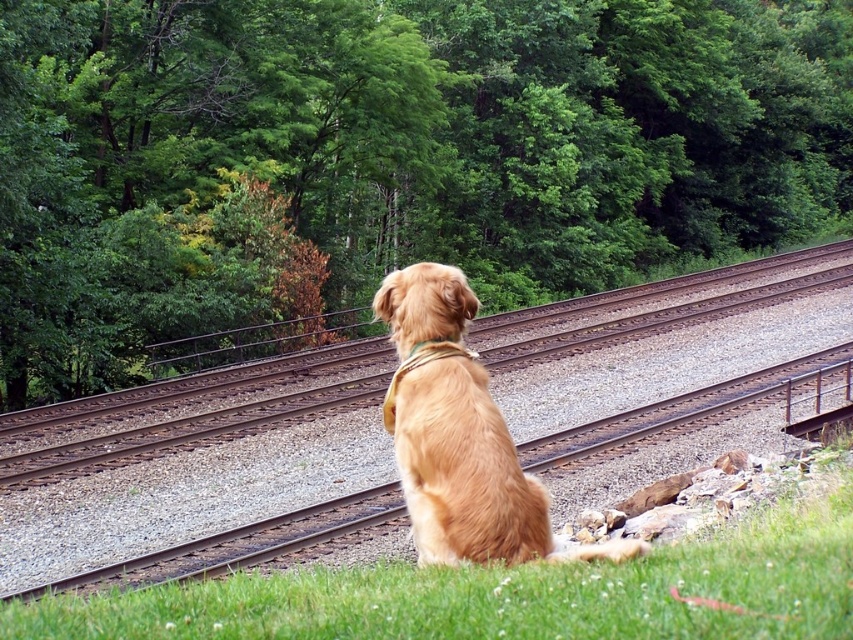
What do you see at coordinates (386, 160) in the screenshot? Image resolution: width=853 pixels, height=640 pixels. I see `green leafy tree at center` at bounding box center [386, 160].

You are a GUI agent. You are given a task and a screenshot of the screen. Output one action in this format:
    pyautogui.click(x=<x>, y=<y>)
    Task: Click on the green leafy tree at center
    The height and width of the screenshot is (640, 853).
    Given the screenshot: What is the action you would take?
    pyautogui.click(x=386, y=160)

Does point (491, 621) come behind point (480, 371)?

No.

Between green soft grass at lower center and golden fur dog at center, which one has less height?

With less height is green soft grass at lower center.

You are a GUI agent. You are given a task and a screenshot of the screen. Output one action in this format:
    pyautogui.click(x=<x>, y=<y>)
    Task: Click on the green soft grass at lower center
    
    Given the screenshot: What is the action you would take?
    pyautogui.click(x=505, y=595)

Who is more forward, (508, 64) or (132, 630)?

Positioned in front is point (132, 630).

Who is taller, green leafy tree at center or green soft grass at lower center?

With more height is green leafy tree at center.

Where is `green leafy tree at center`? green leafy tree at center is located at coordinates (386, 160).